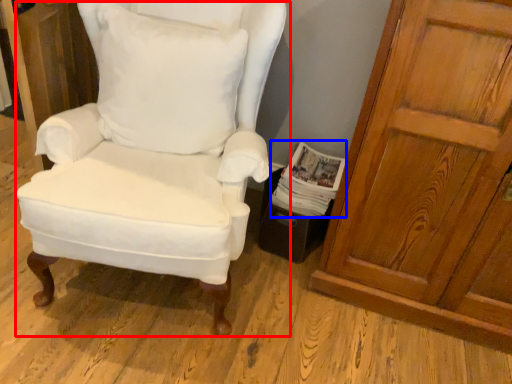
Question: Which point is further to the camera, chair (highlighted by a red box) or magazine (highlighted by a blue box)?

Choices:
 (A) chair
 (B) magazine

Answer: (B)